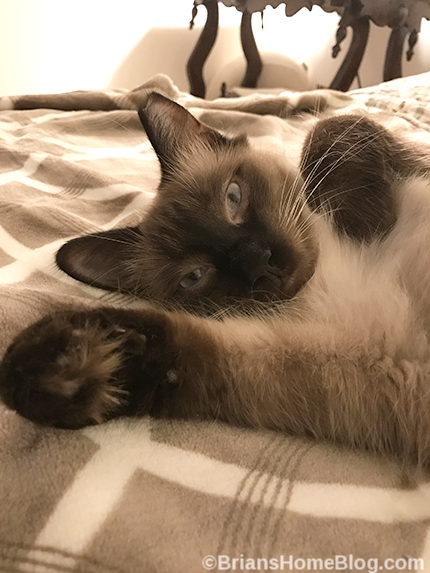
Locate an element on the screen. The image size is (430, 573). lamp shade is located at coordinates (371, 11).